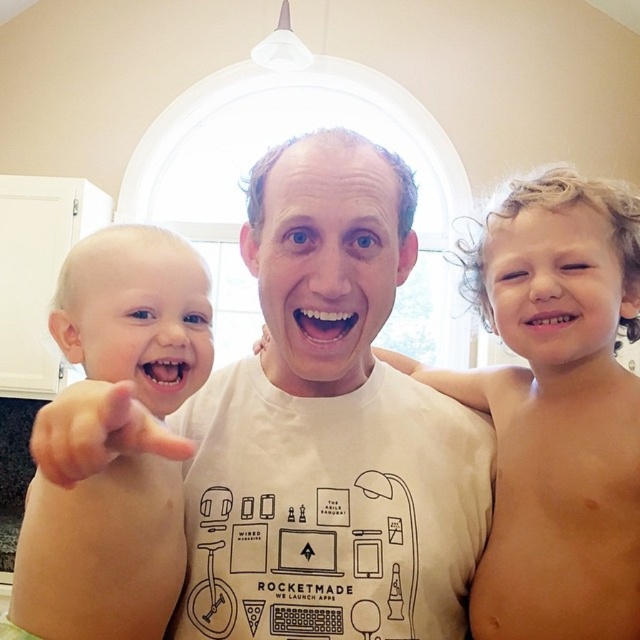
Question: Among these points, which one is farthest from the camera?

Choices:
 (A) (109, 256)
 (B) (448, 435)

Answer: (B)

Question: Which of the following is the farthest from the observer?

Choices:
 (A) (84, 428)
 (B) (204, 358)
 (C) (326, 230)
 (D) (497, 451)

Answer: (D)

Question: Is blonde hair boy at right positioned in front of pink flesh-toned hand at left?

Choices:
 (A) yes
 (B) no

Answer: (B)

Question: Can you confirm if smooth skin baby at left is thinner than pink flesh-toned hand at left?

Choices:
 (A) no
 (B) yes

Answer: (A)

Question: Considering the real-world distances, which object is farthest from the blonde hair boy at right?

Choices:
 (A) smooth skin baby at left
 (B) pink flesh-toned hand at left

Answer: (B)

Question: Can you confirm if white cotton t-shirt at center is positioned above smooth skin baby at left?

Choices:
 (A) yes
 (B) no

Answer: (A)